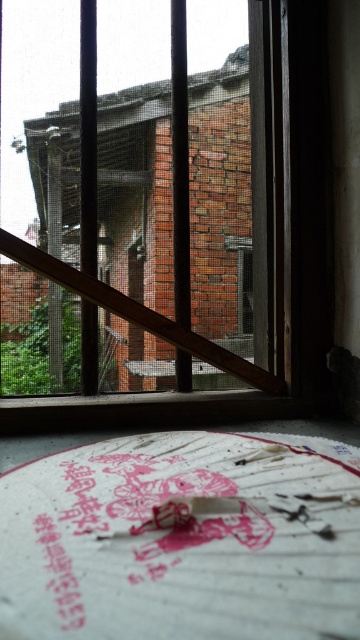
Question: Which point is closer to the camera?

Choices:
 (A) (92, 16)
 (B) (173, 333)

Answer: (B)

Question: Which point is farther to the camera?

Choices:
 (A) brick wall at center
 (B) wooden at center

Answer: (A)

Question: Can you confirm if brick wall at center is positioned to the left of wooden at center?

Choices:
 (A) no
 (B) yes

Answer: (B)

Question: Does brick wall at center have a smaller size compared to wooden at center?

Choices:
 (A) no
 (B) yes

Answer: (A)

Question: Is brick wall at center smaller than wooden at center?

Choices:
 (A) no
 (B) yes

Answer: (A)

Question: Which point is farther to the camera?

Choices:
 (A) brick wall at center
 (B) wooden at center

Answer: (A)